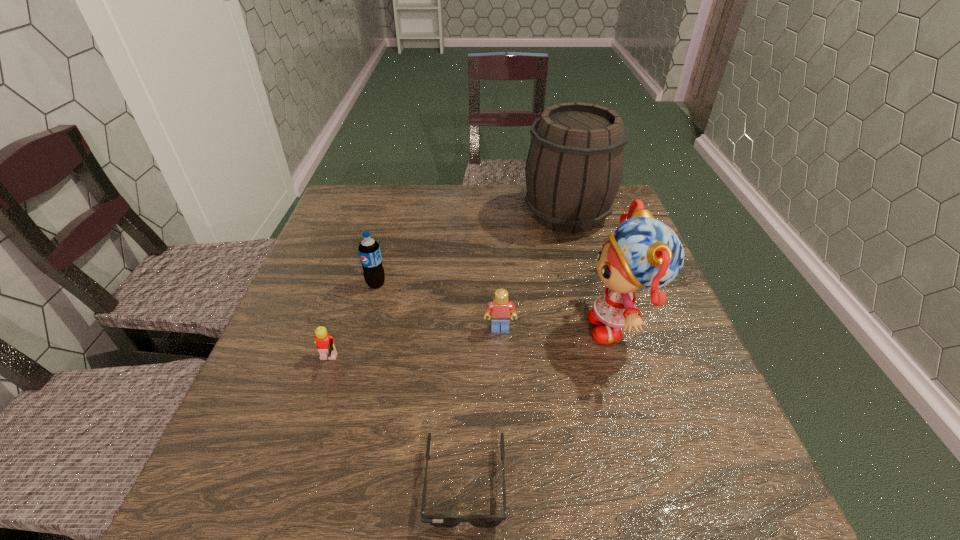
Locate an element on the screen. The width and height of the screenshot is (960, 540). vacant area that lies between the fifth object from right to left and the wine bucket is located at coordinates (471, 249).

Identify the location of vacant point located between the nearer Lego and the farthest object. This screenshot has height=540, width=960. (447, 288).

Find the location of a particular element. The width and height of the screenshot is (960, 540). blank region between the shortest object and the doll is located at coordinates (542, 406).

Where is `free space between the right Lego and the leftmost object`? The width and height of the screenshot is (960, 540). free space between the right Lego and the leftmost object is located at coordinates (414, 346).

Where is `vacant area between the nearest object and the wine bucket`? vacant area between the nearest object and the wine bucket is located at coordinates (516, 349).

Find the location of a particular element. The width and height of the screenshot is (960, 540). free space between the second shortest object and the shortest object is located at coordinates (396, 423).

Where is `object that is the third nearest to the sunglasses`? Image resolution: width=960 pixels, height=540 pixels. object that is the third nearest to the sunglasses is located at coordinates (501, 309).

Identify which object is located as the third nearest to the sunglasses. Please provide its 2D coordinates. Your answer should be formatted as a tuple, i.e. [(x, y)], where the tuple contains the x and y coordinates of a point satisfying the conditions above.

[(501, 309)]

This screenshot has width=960, height=540. In order to click on free space that satisfies the following two spatial constraints: 1. on the front-facing side of the right Lego; 2. in front of the nearer Lego with the accessory visible in this screenshot , I will do `click(501, 362)`.